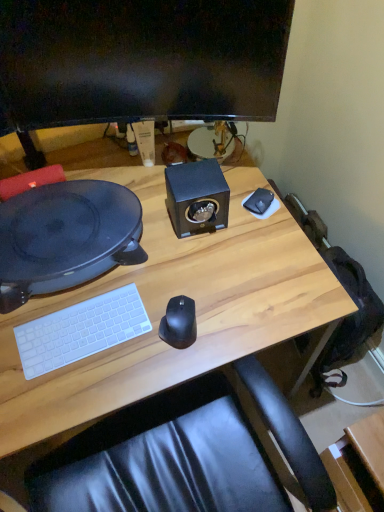
You are a GUI agent. You are given a task and a screenshot of the screen. Output one action in this format:
    pyautogui.click(x=<x>, y=<y>)
    Task: Click on the free space between black matte speaker at center and white matte keyboard at lower left
    Image resolution: width=384 pixels, height=512 pixels.
    Given the screenshot: What is the action you would take?
    pyautogui.click(x=146, y=268)